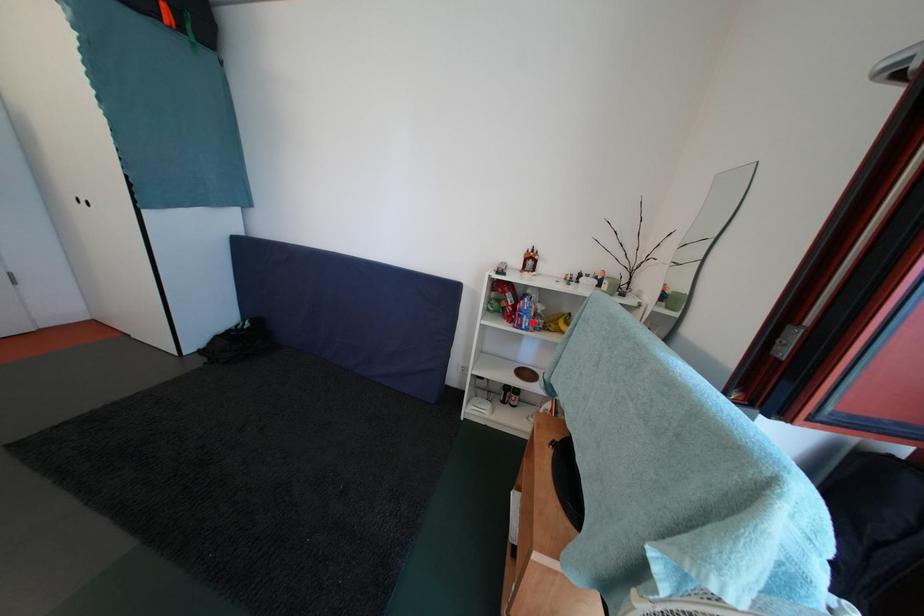
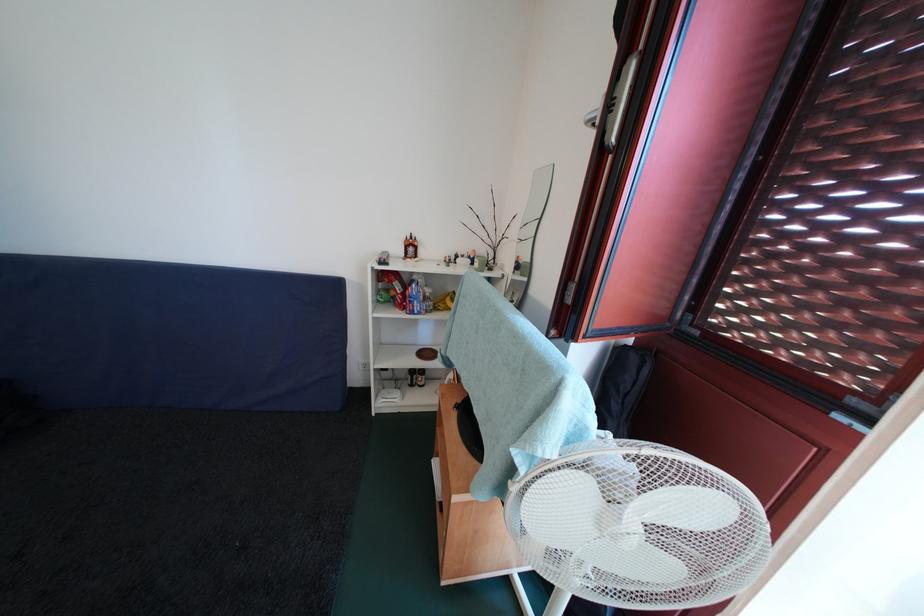
The point at the highlighted location is marked in the first image. Where is the corresponding point in the second image?

(422, 307)